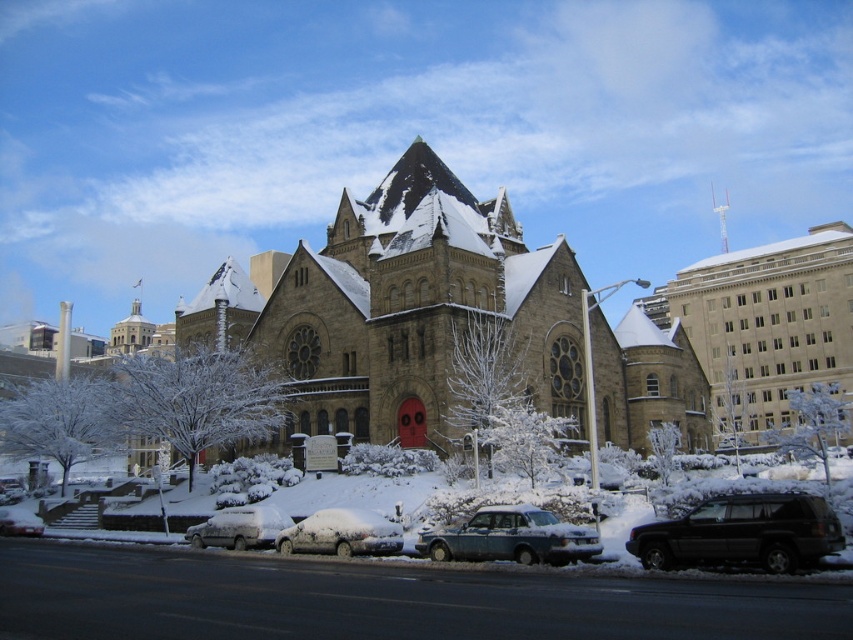
Question: Can you confirm if snow-covered sedan at center is bigger than snow-covered sedan at lower center?

Choices:
 (A) no
 (B) yes

Answer: (B)

Question: Which of the following is the farthest from the observer?

Choices:
 (A) (714, 522)
 (B) (439, 531)

Answer: (B)

Question: Can you confirm if brown stone church at center is wider than snow-covered sedan at center?

Choices:
 (A) no
 (B) yes

Answer: (B)

Question: Based on their relative distances, which object is farther from the white matte van at lower left?

Choices:
 (A) black matte suv at lower right
 (B) snow-covered sedan at center
 (C) snow-covered sedan at lower center

Answer: (A)

Question: Does beige stone church at center have a greater width compared to white matte van at lower left?

Choices:
 (A) no
 (B) yes

Answer: (B)

Question: Which point appears closest to the camera in this image?

Choices:
 (A) (848, 248)
 (B) (263, 545)
 (C) (711, 557)

Answer: (C)